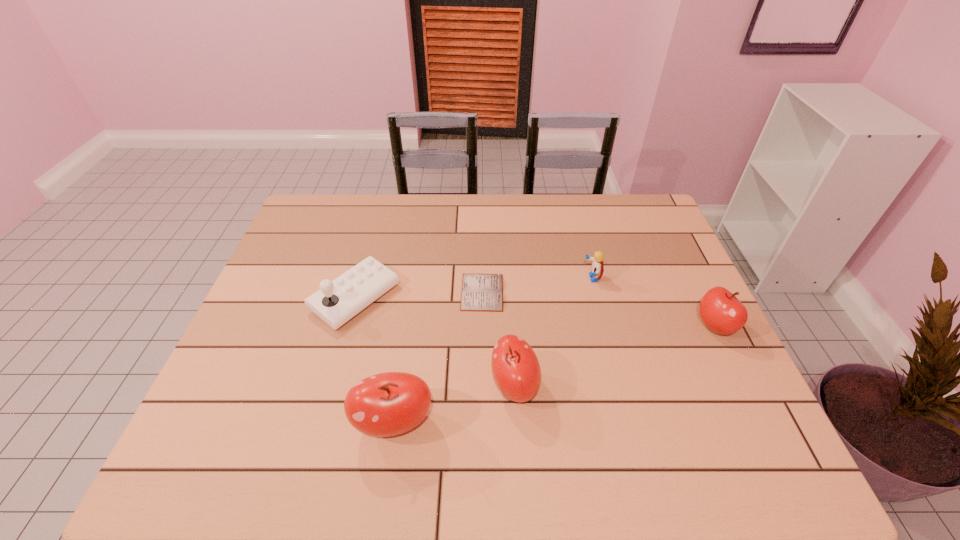
If the aim is uniform spacing by inserting an additional apple among them, please point to a vacant space for this new apple. Please provide its 2D coordinates. Your answer should be formatted as a tuple, i.e. [(x, y)], where the tuple contains the x and y coordinates of a point satisfying the conditions above.

[(620, 354)]